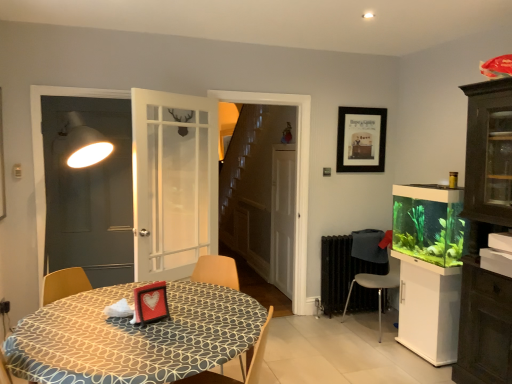
Question: Is white matte screen door at center, the second screen door from the front, smaller than green matte aquarium at right?

Choices:
 (A) yes
 (B) no

Answer: (A)

Question: Considering the relative sizes of white matte screen door at center, the second screen door from the front, and green matte aquarium at right in the image provided, is white matte screen door at center, the second screen door from the front, wider than green matte aquarium at right?

Choices:
 (A) no
 (B) yes

Answer: (A)

Question: Is white matte screen door at center, which is counted as the first screen door, starting from the back, completely or partially outside of green matte aquarium at right?

Choices:
 (A) no
 (B) yes

Answer: (B)

Question: Could you tell me if white matte screen door at center, positioned as the second screen door in left-to-right order, is turned towards green matte aquarium at right?

Choices:
 (A) yes
 (B) no

Answer: (B)

Question: Does white matte screen door at center, which is counted as the first screen door, starting from the back, have a lesser height compared to green matte aquarium at right?

Choices:
 (A) yes
 (B) no

Answer: (B)

Question: From the image's perspective, is green matte aquarium at right located above or below black matte picture frame at upper center?

Choices:
 (A) above
 (B) below

Answer: (B)

Question: Would you say green matte aquarium at right is inside or outside black matte picture frame at upper center?

Choices:
 (A) inside
 (B) outside

Answer: (B)

Question: In the image, is green matte aquarium at right on the left side or the right side of black matte picture frame at upper center?

Choices:
 (A) right
 (B) left

Answer: (A)

Question: Considering the positions of point (445, 249) and point (346, 117), is point (445, 249) closer or farther from the camera than point (346, 117)?

Choices:
 (A) closer
 (B) farther

Answer: (A)

Question: Looking at the image, does patterned fabric table at lower left seem bigger or smaller compared to white glossy cabinet at right?

Choices:
 (A) big
 (B) small

Answer: (A)

Question: In terms of height, does patterned fabric table at lower left look taller or shorter compared to white glossy cabinet at right?

Choices:
 (A) short
 (B) tall

Answer: (B)

Question: Does point (205, 296) appear closer or farther from the camera than point (400, 314)?

Choices:
 (A) closer
 (B) farther

Answer: (A)

Question: From the image's perspective, is patterned fabric table at lower left above or below white glossy cabinet at right?

Choices:
 (A) below
 (B) above

Answer: (B)

Question: From a real-world perspective, is metallic gray chair at lower right, acting as the 1th chair starting from the right, above or below patterned fabric table at lower left?

Choices:
 (A) above
 (B) below

Answer: (B)

Question: Is metallic gray chair at lower right, positioned as the second chair in front-to-back order, wider or thinner than patterned fabric table at lower left?

Choices:
 (A) wide
 (B) thin

Answer: (B)